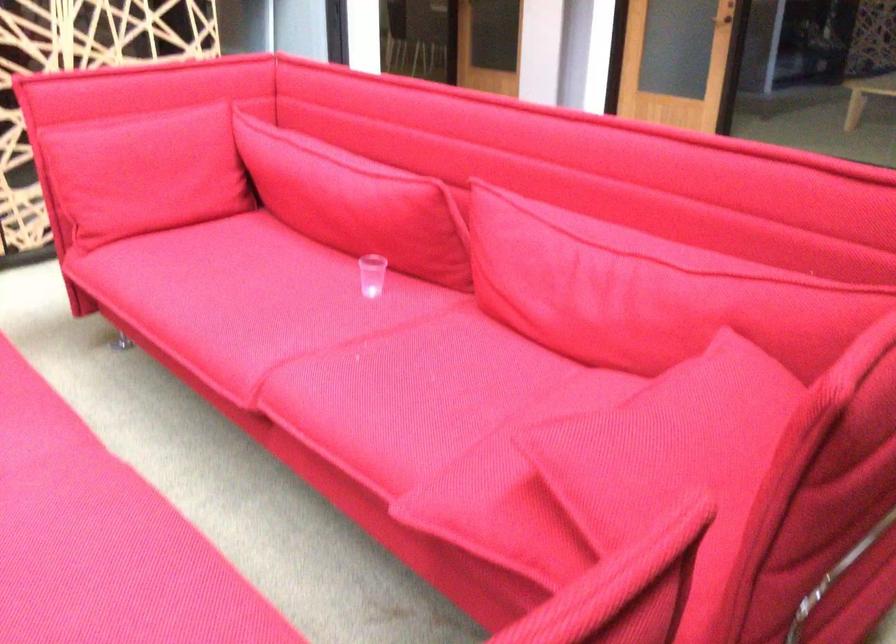
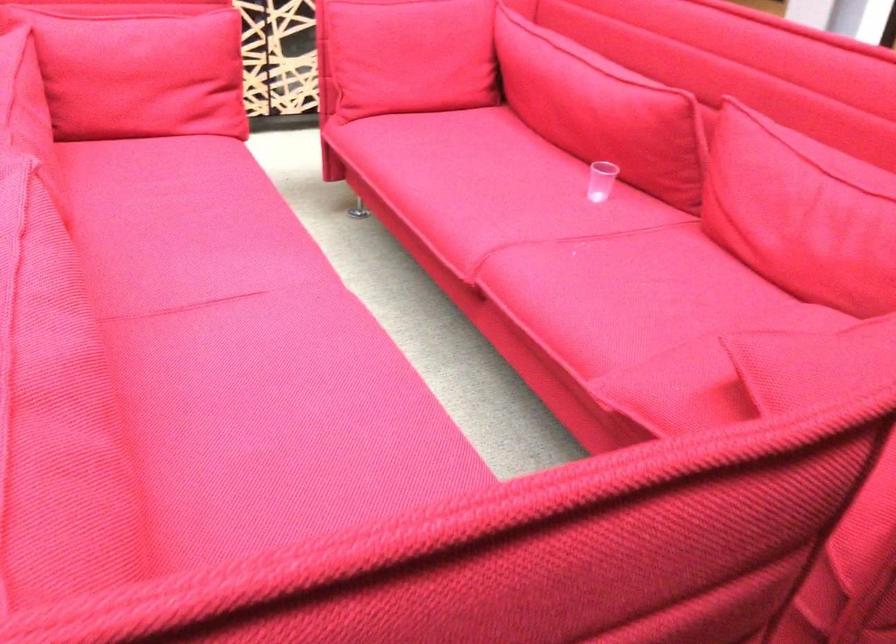
In the second image, find the point that corresponds to point 566,283 in the first image.

(800, 213)